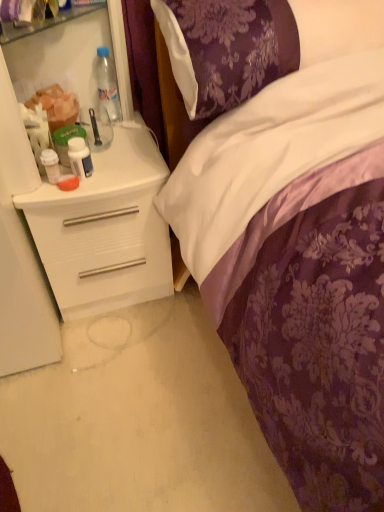
Find the location of a particular element. The image size is (384, 512). free spot to the right of white plastic cup at left, which is the 1th bottle in left-to-right order is located at coordinates (119, 170).